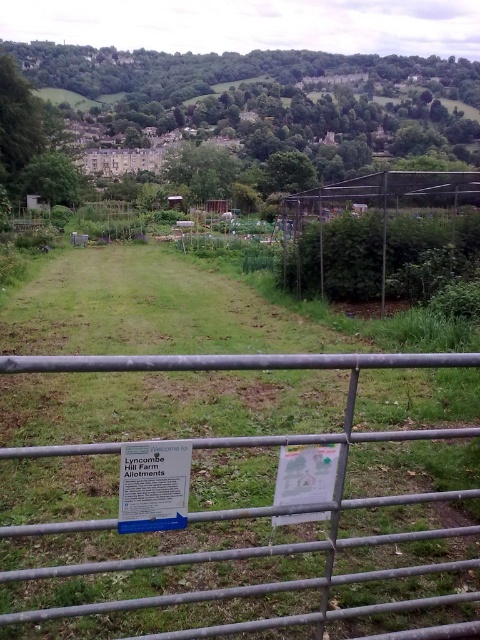
You are a visitor at Lyncombe Hill Farm Allotments and need to find the entrance. You see a white plastic sign at center and a wire mesh fence at center. Which object is smaller in size?

The white plastic sign at center occupies less space than the wire mesh fence at center, so the white plastic sign at center is smaller in size.

You are a visitor arriving at Lyncombe Hill Farm Allotments and want to enter the garden area. The entrance is through the metal gate at center. However, you notice a wire mesh fence at center blocking your path. Can you pass through the entrance without climbing over the fence?

The metal gate at center is in front of the wire mesh fence at center, so you can pass through the entrance without climbing over the fence because the gate provides access through the fence.

You are a visitor arriving at Lyncombe Hill Farm Allotments and see the metal gate at center and the white plastic sign at center. Which object would you interact with first to enter the allotments?

The metal gate at center is in front of the white plastic sign at center, so you would need to interact with the metal gate at center first to enter the allotments.